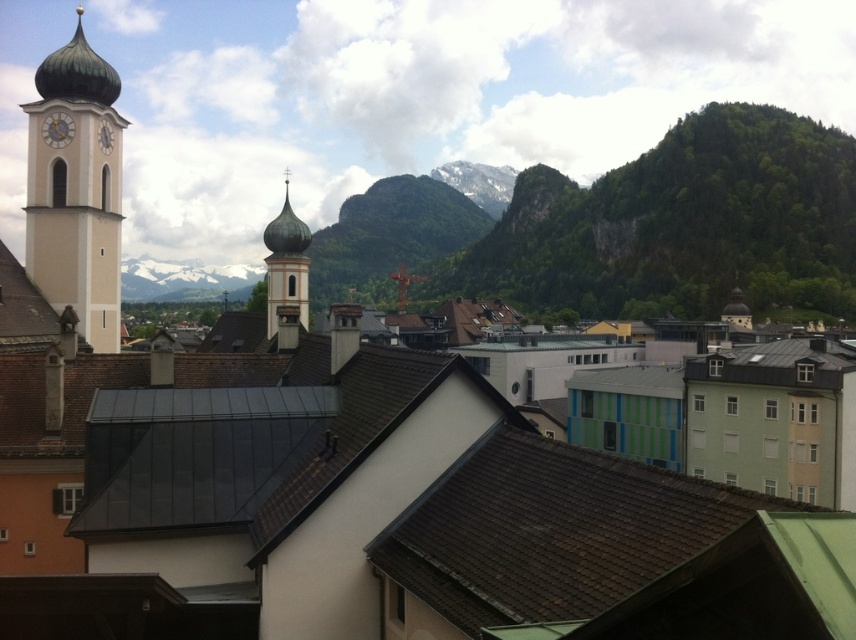
Between brown shingles at center and white stucco bell tower at left, which one is positioned lower?

brown shingles at center

Based on the photo, is brown shingles at center bigger than white stucco bell tower at left?

No, brown shingles at center is not bigger than white stucco bell tower at left.

Who is more distant from viewer, [513,518] or [97,340]?

Point [97,340]

Where is `brown shingles at center`? The image size is (856, 640). brown shingles at center is located at coordinates (607, 552).

Which is below, brown shingles at center or green copper dome at center?

brown shingles at center

Can you confirm if brown shingles at center is positioned above green copper dome at center?

Actually, brown shingles at center is below green copper dome at center.

The image size is (856, 640). What do you see at coordinates (607, 552) in the screenshot? I see `brown shingles at center` at bounding box center [607, 552].

Image resolution: width=856 pixels, height=640 pixels. I want to click on brown shingles at center, so click(x=607, y=552).

Between white stucco bell tower at left and green copper dome at center, which one has more height?

white stucco bell tower at left

How much distance is there between white stucco bell tower at left and green copper dome at center?

white stucco bell tower at left and green copper dome at center are 10.91 meters apart.

Which is in front, point (85, 104) or point (272, 224)?

Point (85, 104) is in front.

At what (x,y) coordinates should I click in order to perform the action: click on white stucco bell tower at left. Please return your answer as a coordinate pair (x, y). The image size is (856, 640). Looking at the image, I should click on (76, 188).